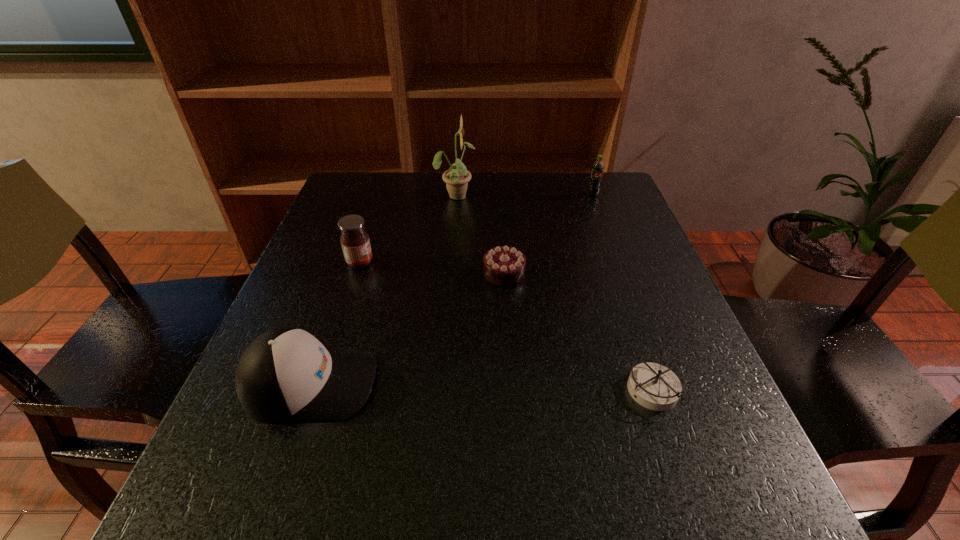
At what (x,y) coordinates should I click in order to perform the action: click on vacant region at the far edge. Please return your answer as a coordinate pair (x, y). Looking at the image, I should click on (536, 192).

Locate an element on the screen. The image size is (960, 540). free location at the left edge is located at coordinates (344, 269).

Image resolution: width=960 pixels, height=540 pixels. In order to click on vacant area at the right edge in this screenshot , I will do tap(604, 234).

You are a GUI agent. You are given a task and a screenshot of the screen. Output one action in this format:
    pyautogui.click(x=<x>, y=<y>)
    Task: Click on the vacant space at the far left corner
    The width and height of the screenshot is (960, 540).
    Given the screenshot: What is the action you would take?
    pyautogui.click(x=386, y=186)

I want to click on vacant space at the far right corner, so click(x=608, y=217).

Locate an element on the screen. Image resolution: width=960 pixels, height=540 pixels. vacant point located between the compass and the cap is located at coordinates (482, 387).

The width and height of the screenshot is (960, 540). I want to click on free space between the third object from right to left and the cap, so click(407, 328).

At what (x,y) coordinates should I click in order to perform the action: click on free spot between the jam and the cap. Please return your answer as a coordinate pair (x, y). Looking at the image, I should click on (335, 323).

Identify the location of vacant area that lies between the chocolate cake and the soda. (548, 234).

The width and height of the screenshot is (960, 540). Identify the location of vacant point located between the jam and the soda. (476, 228).